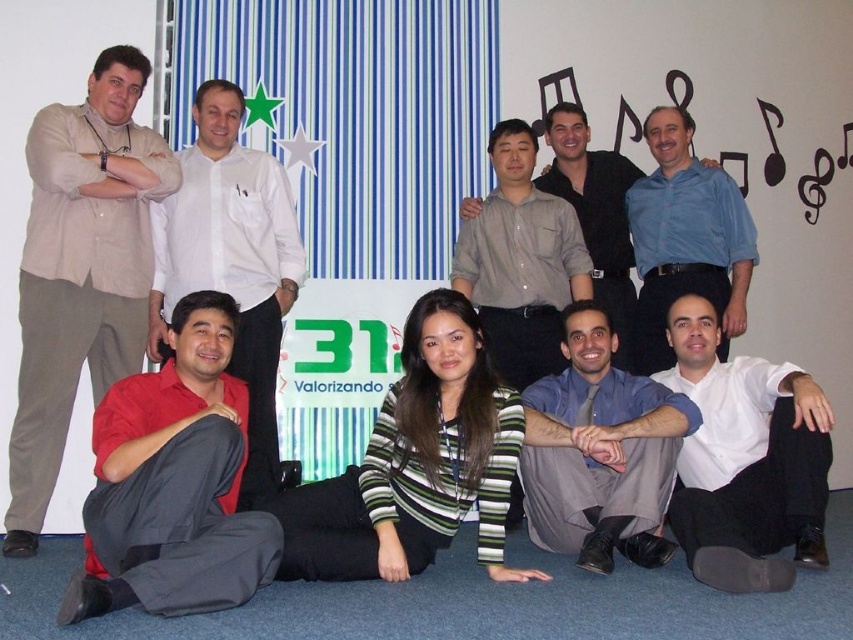
Question: Does beige linen shirt at left have a lesser width compared to white glossy shirt at lower right?

Choices:
 (A) yes
 (B) no

Answer: (B)

Question: Which is farther from the red satin shirt at lower left?

Choices:
 (A) light blue shirt at upper center
 (B) blue shirt at lower center
 (C) beige linen shirt at left

Answer: (A)

Question: Which of the following is the farthest from the observer?

Choices:
 (A) (698, 531)
 (B) (80, 204)

Answer: (B)

Question: Which object appears farthest from the camera in this image?

Choices:
 (A) blue shirt at center
 (B) beige linen shirt at left
 (C) white glossy shirt at lower right

Answer: (A)

Question: Where is red satin shirt at lower left located in relation to red shirt at lower left in the image?

Choices:
 (A) below
 (B) above

Answer: (A)

Question: Does beige linen shirt at left have a larger size compared to blue shirt at lower center?

Choices:
 (A) yes
 (B) no

Answer: (A)